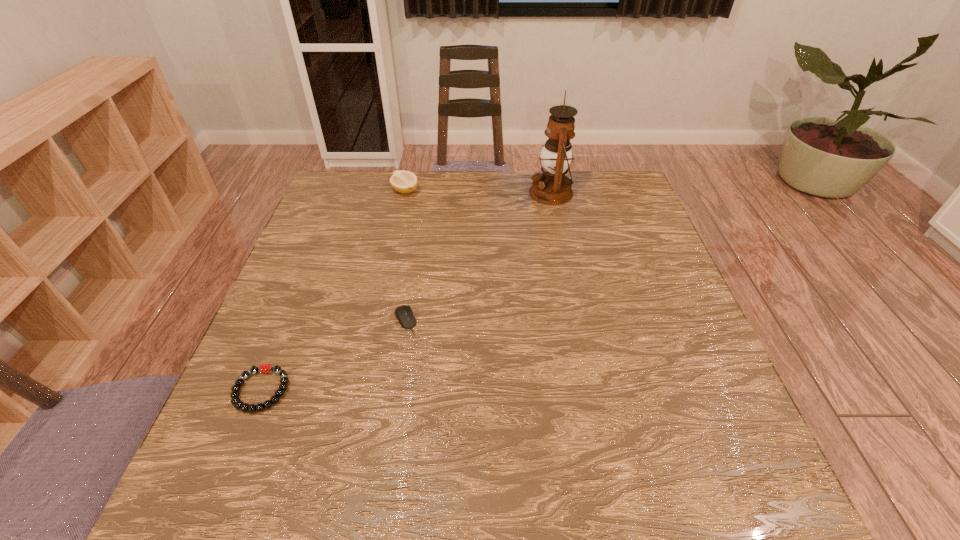
I want to click on lantern, so click(x=552, y=187).

What are the coordinates of `the tallest object` in the screenshot? It's located at (552, 187).

You are a GUI agent. You are given a task and a screenshot of the screen. Output one action in this format:
    pyautogui.click(x=<x>, y=<y>)
    Task: Click on the lemon
    
    Given the screenshot: What is the action you would take?
    pyautogui.click(x=402, y=181)

Image resolution: width=960 pixels, height=540 pixels. I want to click on the second shortest object, so click(404, 314).

Where is `computer mouse`? The width and height of the screenshot is (960, 540). computer mouse is located at coordinates [x=404, y=314].

Where is `the nearest object`? This screenshot has height=540, width=960. the nearest object is located at coordinates (264, 368).

In order to click on the leftmost object in this screenshot , I will do `click(264, 368)`.

I want to click on free space located on the side of the lantern, there is a wick adjustment knob, so click(503, 193).

Where is `free space located on the side of the lantern, there is a wick adjustment knob`? This screenshot has height=540, width=960. free space located on the side of the lantern, there is a wick adjustment knob is located at coordinates (419, 193).

The height and width of the screenshot is (540, 960). What are the coordinates of `vacant space located 0.200m on the side of the lantern, there is a wick adjustment knob` in the screenshot? It's located at (465, 193).